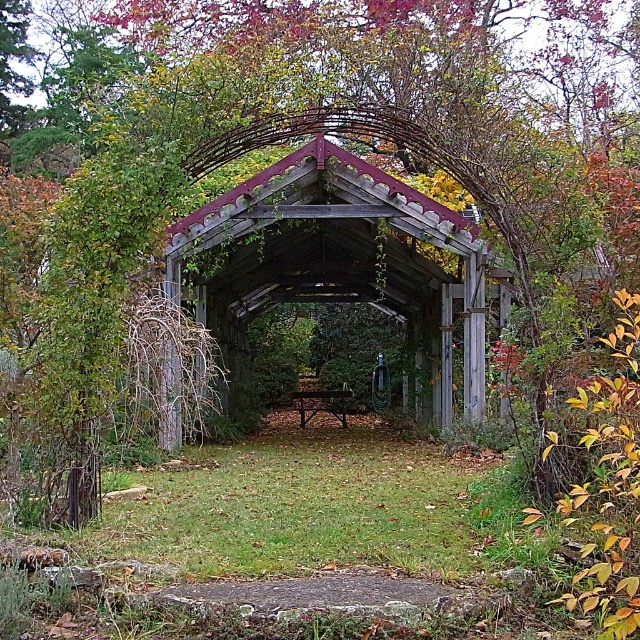
You are standing at the entrance of the garden and see the wooden gazebo at center and the wooden park bench at center. Which one is positioned to the right side of the other?

The wooden gazebo at center is positioned to the right of the wooden park bench at center.

You are planning to install a new lighting system for the wooden gazebo at center and the wooden park bench at center. Which object requires taller light fixtures to accommodate its height?

The wooden gazebo at center requires taller light fixtures because it has a greater height compared to the wooden park bench at center.

You are standing at the entrance of the garden and see two points marked in the image. Which point is closer to you, point (346,204) or point (332,403)?

Point (346,204) is in front of point (332,403), so it is closer to you.